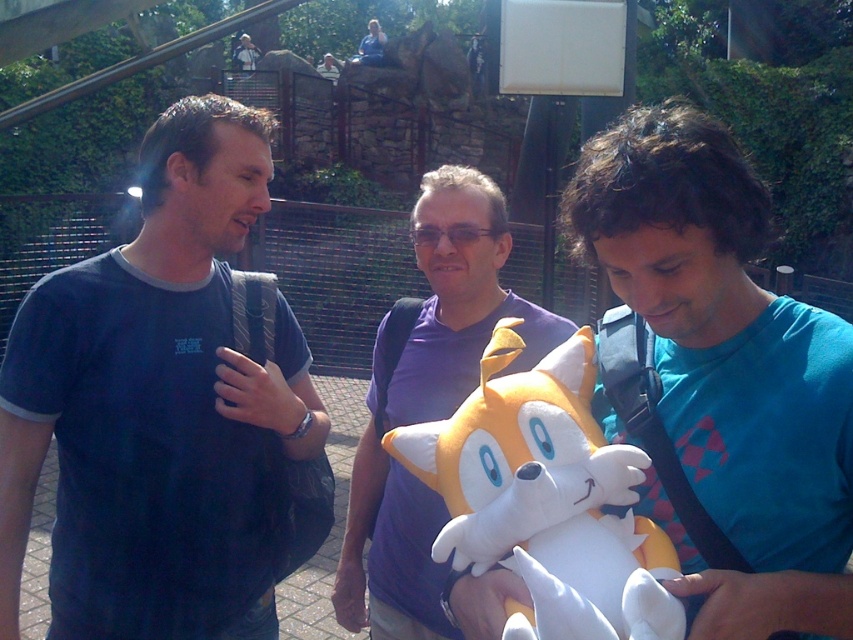
Which is below, dark blue t-shirt at left or purple fabric shirt at center?

Positioned lower is purple fabric shirt at center.

Between point (26, 307) and point (415, 564), which one is positioned in front?

Point (26, 307) is in front.

The height and width of the screenshot is (640, 853). I want to click on dark blue t-shirt at left, so click(x=155, y=404).

Between purple fabric shirt at center and white plush toy at center, which one appears on the left side from the viewer's perspective?

Positioned to the left is purple fabric shirt at center.

Measure the distance from purple fabric shirt at center to white plush toy at center.

purple fabric shirt at center and white plush toy at center are 11.01 inches apart.

Which is behind, point (363, 448) or point (567, 440)?

The point (363, 448) is behind.

Find the location of a particular element. This screenshot has width=853, height=640. purple fabric shirt at center is located at coordinates point(428,403).

Is blue cotton shirt at center positioned at the back of purple fabric shirt at center?

No, blue cotton shirt at center is in front of purple fabric shirt at center.

Can you confirm if blue cotton shirt at center is bigger than purple fabric shirt at center?

Incorrect, blue cotton shirt at center is not larger than purple fabric shirt at center.

Is point (793, 616) positioned after point (495, 314)?

No, it is in front of (495, 314).

This screenshot has height=640, width=853. I want to click on blue cotton shirt at center, so click(x=718, y=378).